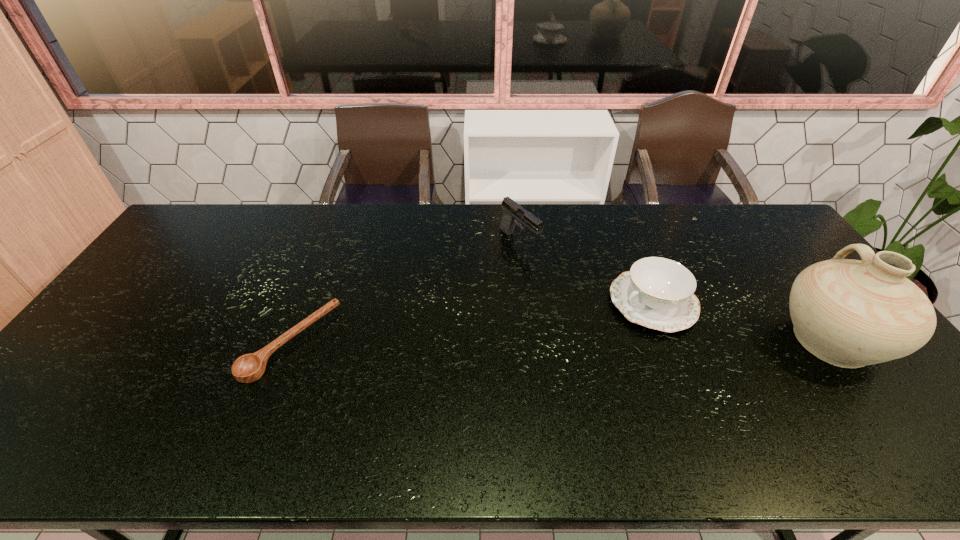
What are the coordinates of `free point between the leftmost object and the second shortest object` in the screenshot? It's located at (472, 323).

This screenshot has height=540, width=960. Identify the location of free space that is in between the farthest object and the third object from left to right. (587, 272).

Locate an element on the screen. vacant region between the shortest object and the tallest object is located at coordinates (562, 341).

In order to click on vacant area between the pottery and the second shortest object in this screenshot , I will do point(742,321).

You are a GUI agent. You are given a task and a screenshot of the screen. Output one action in this format:
    pyautogui.click(x=<x>, y=<y>)
    Task: Click on the vacant point located between the rightmost object and the wooden spoon
    
    Given the screenshot: What is the action you would take?
    pyautogui.click(x=562, y=341)

Locate an element on the screen. Image resolution: width=960 pixels, height=540 pixels. free area in between the rightmost object and the shortest object is located at coordinates (562, 341).

Locate an element on the screen. free space between the farthest object and the chinaware is located at coordinates (587, 272).

The height and width of the screenshot is (540, 960). In order to click on the third closest object to the rightmost object in this screenshot , I will do `click(248, 368)`.

Identify which object is located as the second nearest to the pistol. Please provide its 2D coordinates. Your answer should be formatted as a tuple, i.e. [(x, y)], where the tuple contains the x and y coordinates of a point satisfying the conditions above.

[(248, 368)]

Locate an element on the screen. The image size is (960, 540). free space that satisfies the following two spatial constraints: 1. on the back side of the third object from left to right; 2. on the right side of the shortest object is located at coordinates (307, 303).